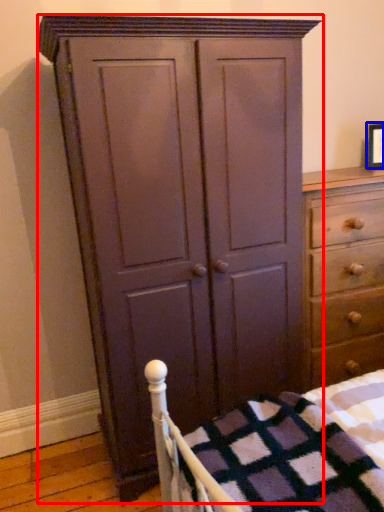
Question: Which point is closer to the camera, cupboard (highlighted by a red box) or picture frame (highlighted by a blue box)?

Choices:
 (A) cupboard
 (B) picture frame

Answer: (A)